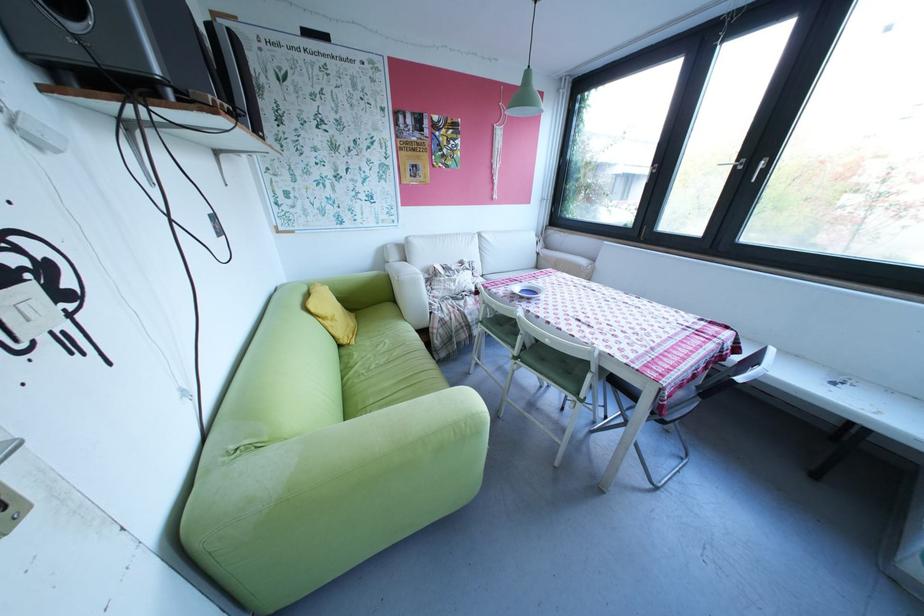
Find where to sit the green sofa sitting surface. Please return your answer as a coordinate pair (x, y).

(384, 363)